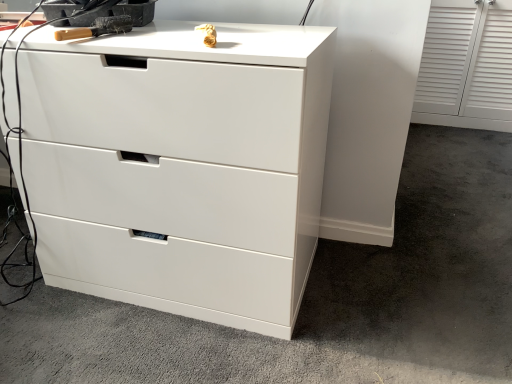
The height and width of the screenshot is (384, 512). Find the location of `vacant space in front of white glossy chest of drawers at center`. vacant space in front of white glossy chest of drawers at center is located at coordinates (162, 347).